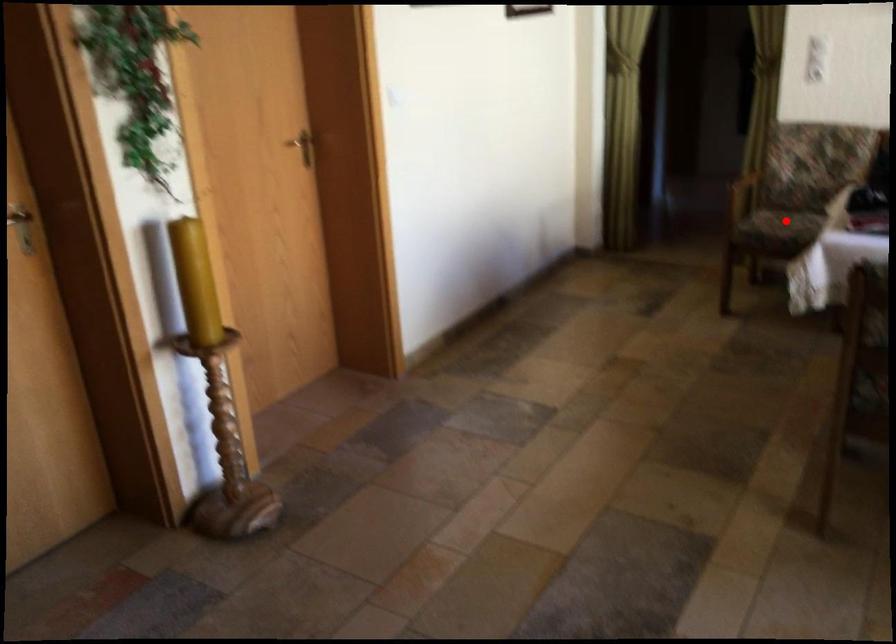
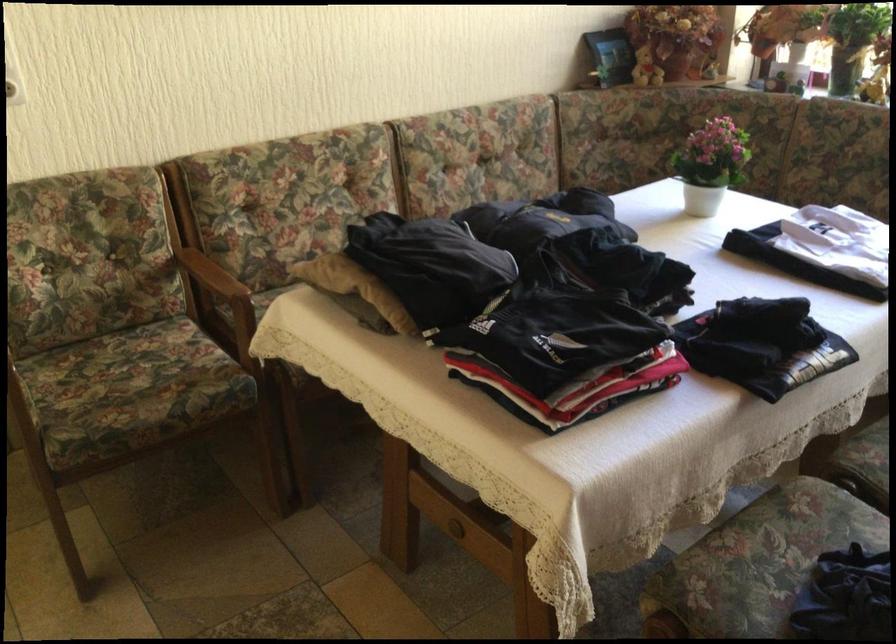
Locate, in the second image, the point that corresponds to the highlighted location in the first image.

(130, 383)